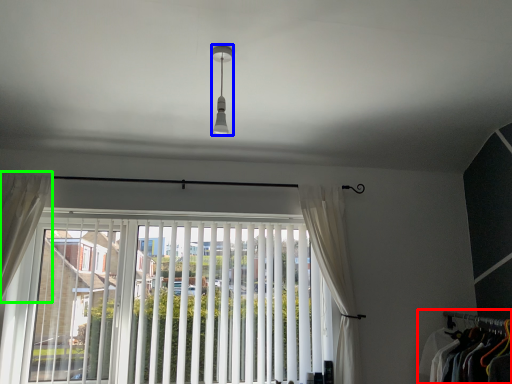
Question: Which object is positioned closest to closet (highlighted by a red box)? Select from light fixture (highlighted by a blue box) and curtain (highlighted by a green box).

Choices:
 (A) light fixture
 (B) curtain

Answer: (A)